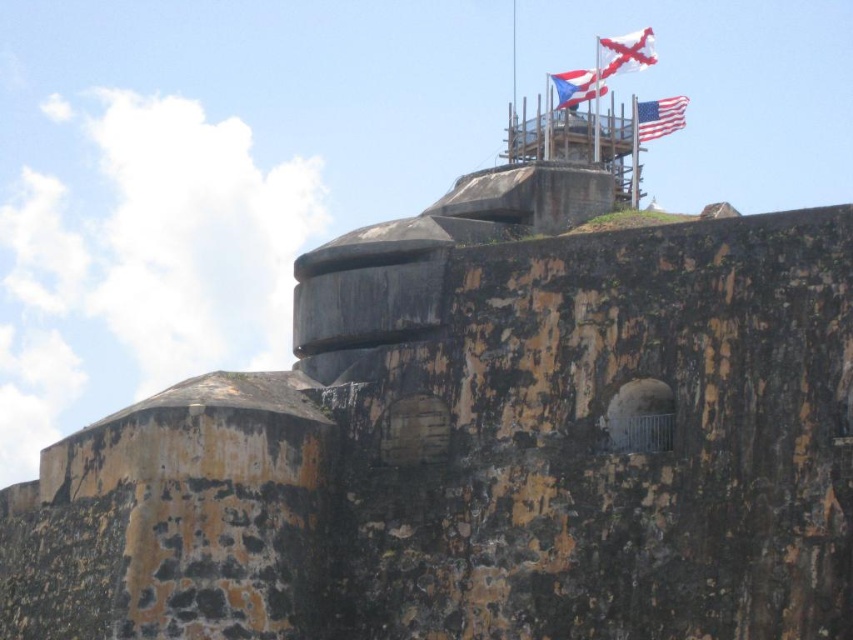
Question: Does matte american flag at upper right appear under matte blue and white flag at top?

Choices:
 (A) yes
 (B) no

Answer: (A)

Question: Which of the following is the closest to the observer?

Choices:
 (A) matte blue and white flag at top
 (B) white striped fabric at top

Answer: (A)

Question: Is white striped fabric at top thinner than matte blue and white flag at top?

Choices:
 (A) no
 (B) yes

Answer: (A)

Question: In this image, where is white striped fabric at top located relative to matte blue and white flag at top?

Choices:
 (A) right
 (B) left

Answer: (A)

Question: Which object is the closest to the matte blue and white flag at top?

Choices:
 (A) matte american flag at upper right
 (B) white striped fabric at top

Answer: (B)

Question: Among these objects, which one is farthest from the camera?

Choices:
 (A) matte american flag at upper right
 (B) white striped fabric at top

Answer: (B)